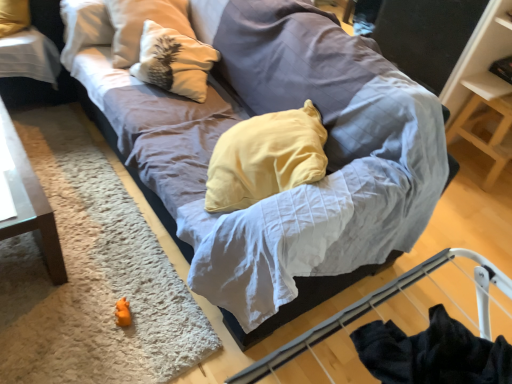
Find the location of a particular element. unoccupied region to the right of orange plush toy at lower left is located at coordinates (167, 326).